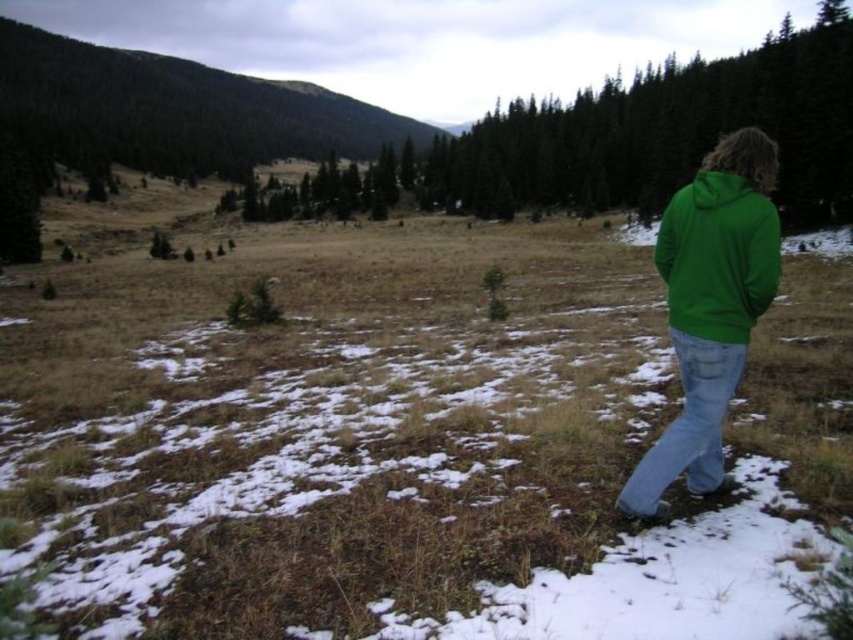
Can you confirm if green fabric jacket at right is positioned to the left of green fleece jacket at right?

Yes, green fabric jacket at right is to the left of green fleece jacket at right.

Between point (544, 428) and point (723, 204), which one is positioned behind?

Positioned behind is point (544, 428).

Is point (178, 548) positioned behind point (697, 332)?

Yes, it is.

Where is `green fabric jacket at right`? This screenshot has height=640, width=853. green fabric jacket at right is located at coordinates (398, 436).

Which is behind, point (119, 356) or point (706, 179)?

Point (119, 356)

Does point (537, 556) come closer to viewer compared to point (697, 173)?

Yes, point (537, 556) is closer to viewer.

Is point (599, 406) closer to viewer compared to point (660, 250)?

No.

What are the coordinates of `green fabric jacket at right` in the screenshot? It's located at pos(398,436).

Looking at this image, does green fleece jacket at right have a lesser height compared to green fleece sweatshirt at right?

In fact, green fleece jacket at right may be taller than green fleece sweatshirt at right.

Can you confirm if green fleece jacket at right is thinner than green fleece sweatshirt at right?

In fact, green fleece jacket at right might be wider than green fleece sweatshirt at right.

At what (x,y) coordinates should I click in order to perform the action: click on green fleece jacket at right. Please return your answer as a coordinate pair (x, y). Looking at the image, I should click on (711, 308).